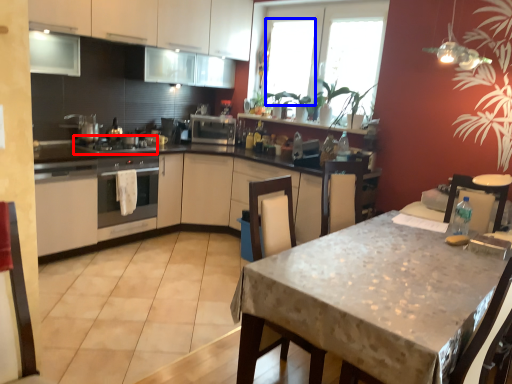
Question: Which object appears farthest to the camera in this image, appliance (highlighted by a red box) or window (highlighted by a blue box)?

Choices:
 (A) appliance
 (B) window

Answer: (B)